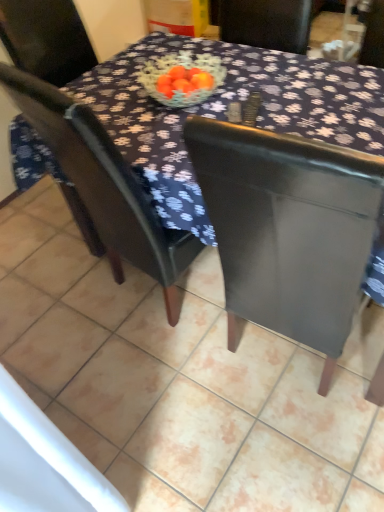
The image size is (384, 512). I want to click on blank space above matte black table at center (from a real-world perspective), so click(x=129, y=326).